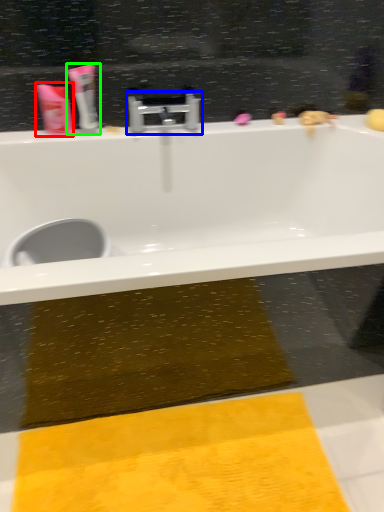
Question: Which object is the farthest from toiletry (highlighted by a red box)? Choose among these: tap (highlighted by a blue box) or toothpaste (highlighted by a green box).

Choices:
 (A) tap
 (B) toothpaste

Answer: (A)